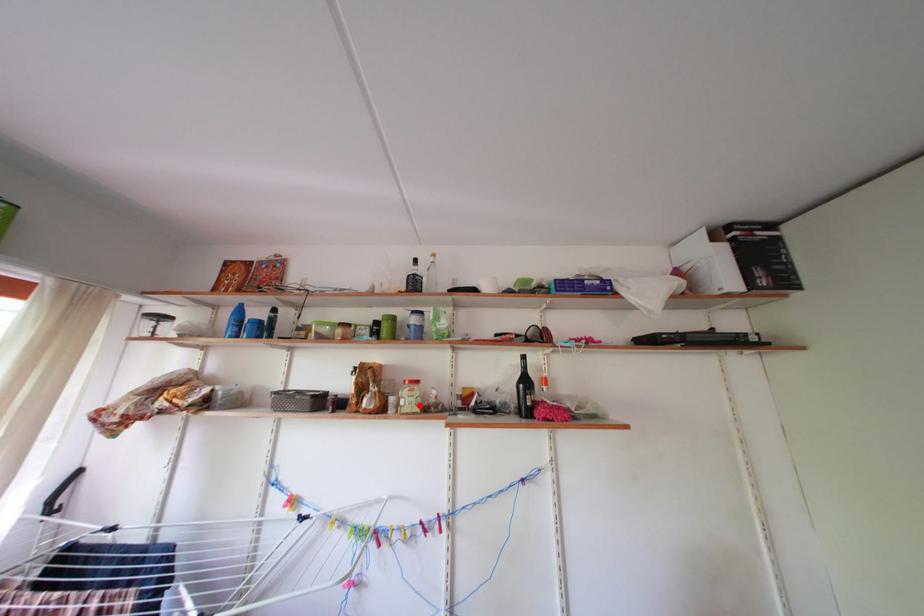
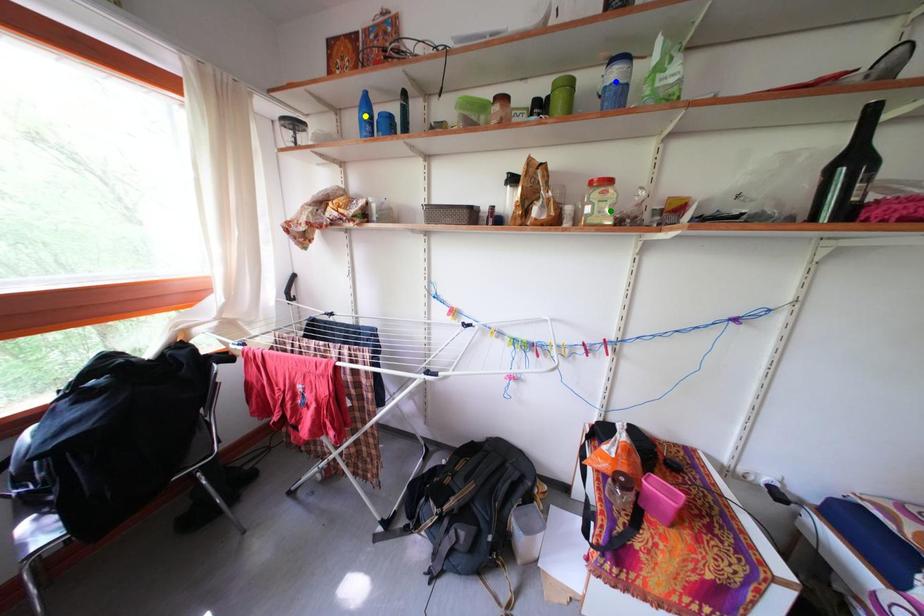
Question: I am providing you with two images of the same scene from different viewpoints. A red point is marked on the first image. You are given multiple points on the second image. In image 2, which mark is for the same physical point as the one in image 1?

Choices:
 (A) blue point
 (B) green point
 (C) yellow point

Answer: (B)